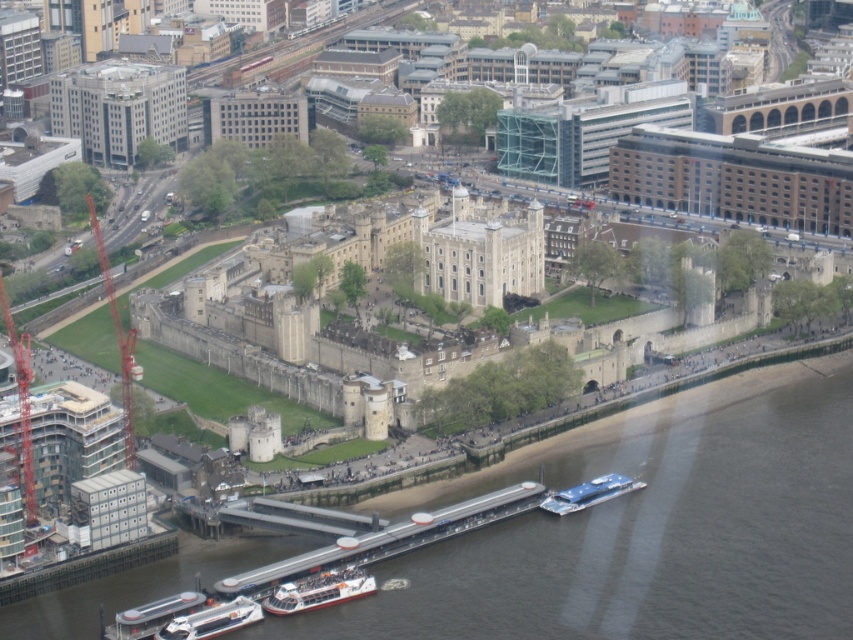
Question: Is the position of orange metallic crane at left more distant than that of white glossy boat at lower left?

Choices:
 (A) no
 (B) yes

Answer: (B)

Question: Is white glossy boat at lower center bigger than blue metallic boat at lower center?

Choices:
 (A) yes
 (B) no

Answer: (B)

Question: In this image, where is reddish-brown metallic crane at left located relative to white glossy boat at lower left?

Choices:
 (A) below
 (B) above

Answer: (B)

Question: Among these objects, which one is nearest to the camera?

Choices:
 (A) white plastic boat at lower left
 (B) white glossy boat at lower center
 (C) dark gray water at lower center

Answer: (C)

Question: Estimate the real-world distances between objects in this image. Which object is farther from the blue metallic boat at lower center?

Choices:
 (A) white glossy boat at lower left
 (B) gray concrete building at upper left
 (C) white plastic boat at lower left
 (D) dark gray water at lower center

Answer: (B)

Question: Estimate the real-world distances between objects in this image. Which object is farther from the gray concrete building at upper left?

Choices:
 (A) dark gray water at lower center
 (B) white glossy boat at lower left
 (C) white glossy boat at lower center

Answer: (B)